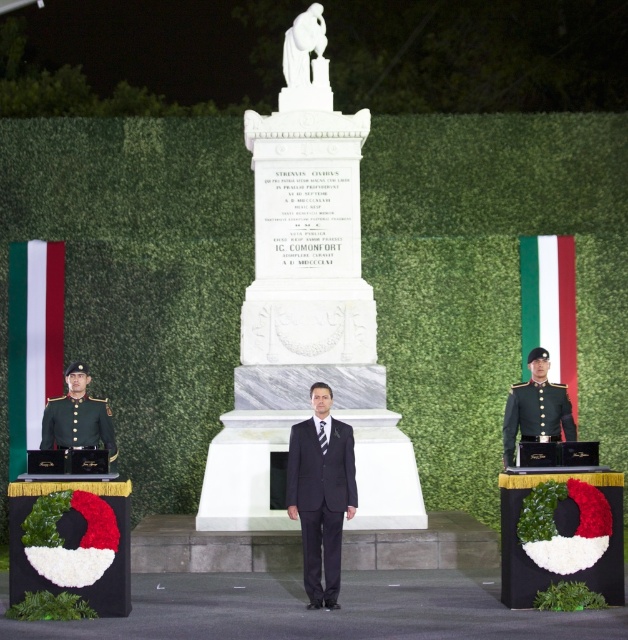
Question: Estimate the real-world distances between objects in this image. Which object is closer to the green uniform at left?

Choices:
 (A) green uniform at right
 (B) white marble monument at center
 (C) dark gray suit at center

Answer: (B)

Question: Does white marble monument at center have a larger size compared to green uniform at left?

Choices:
 (A) yes
 (B) no

Answer: (A)

Question: Which object is positioned farthest from the green uniform at right?

Choices:
 (A) dark gray suit at center
 (B) white marble monument at center

Answer: (A)

Question: Does white marble monument at center appear under green uniform at left?

Choices:
 (A) yes
 (B) no

Answer: (B)

Question: Which object is the closest to the green uniform at right?

Choices:
 (A) dark gray suit at center
 (B) white marble monument at center

Answer: (B)

Question: Where is dark gray suit at center located in relation to green uniform at right in the image?

Choices:
 (A) right
 (B) left

Answer: (B)